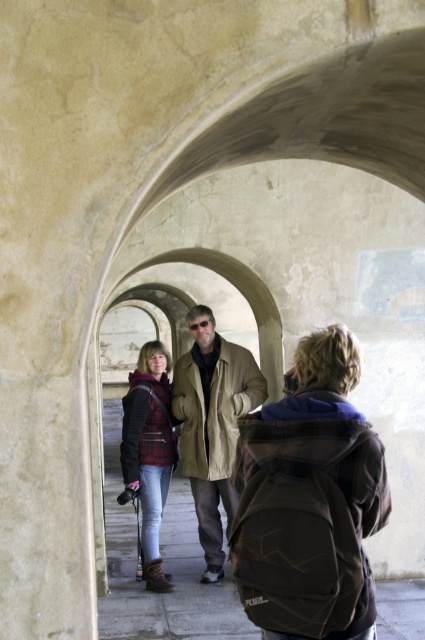
Question: Which object is positioned closest to the brown fabric backpack at center?

Choices:
 (A) plaid fabric jacket at center
 (B) tan leather jacket at center
 (C) brown plaid jacket at center

Answer: (A)

Question: Is brown fabric backpack at center bigger than tan leather jacket at center?

Choices:
 (A) no
 (B) yes

Answer: (A)

Question: Which point is closer to the camera?

Choices:
 (A) plaid fabric jacket at center
 (B) brown plaid jacket at center

Answer: (B)

Question: Does brown fabric backpack at center have a larger size compared to tan leather jacket at center?

Choices:
 (A) no
 (B) yes

Answer: (A)

Question: Among these points, which one is farthest from the camera?

Choices:
 (A) (172, 576)
 (B) (221, 531)

Answer: (A)

Question: Is brown fabric backpack at center smaller than tan leather jacket at center?

Choices:
 (A) no
 (B) yes

Answer: (B)